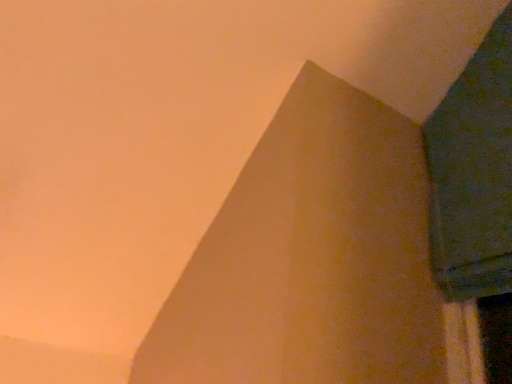
Identify the location of dark green fabric at lower right. This screenshot has width=512, height=384. (475, 210).

This screenshot has height=384, width=512. Describe the element at coordinates (475, 210) in the screenshot. I see `dark green fabric at lower right` at that location.

This screenshot has height=384, width=512. I want to click on dark green fabric at lower right, so click(475, 210).